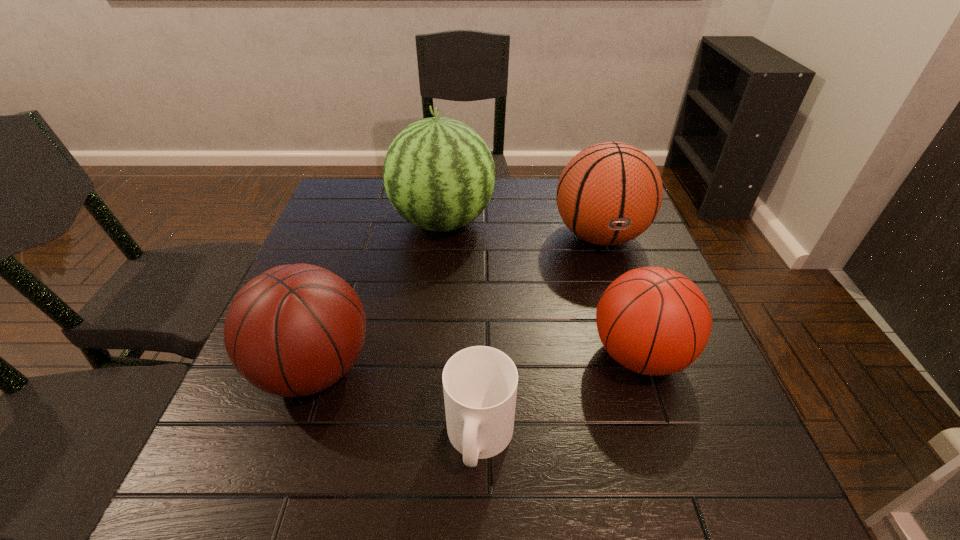
Where is `the tallest object`? The image size is (960, 540). the tallest object is located at coordinates (439, 175).

Locate an element on the screen. the farthest basketball is located at coordinates (609, 193).

Where is `the leftmost basketball`? The height and width of the screenshot is (540, 960). the leftmost basketball is located at coordinates (295, 330).

Find the location of a particular element. This screenshot has width=960, height=540. the shortest object is located at coordinates (480, 383).

I want to click on vacant region located 0.090m on the right of the watermelon, so click(526, 222).

The width and height of the screenshot is (960, 540). I want to click on free point located 0.110m on the side where the inflation valve is located, so click(x=620, y=298).

Identify the location of blank space located 0.290m on the back of the leftmost basketball. (357, 243).

The image size is (960, 540). I want to click on watermelon that is positioned at the far edge, so click(439, 175).

Identify the location of basketball that is at the far edge. The image size is (960, 540). tap(609, 193).

This screenshot has height=540, width=960. In order to click on object that is at the near edge in this screenshot , I will do `click(480, 383)`.